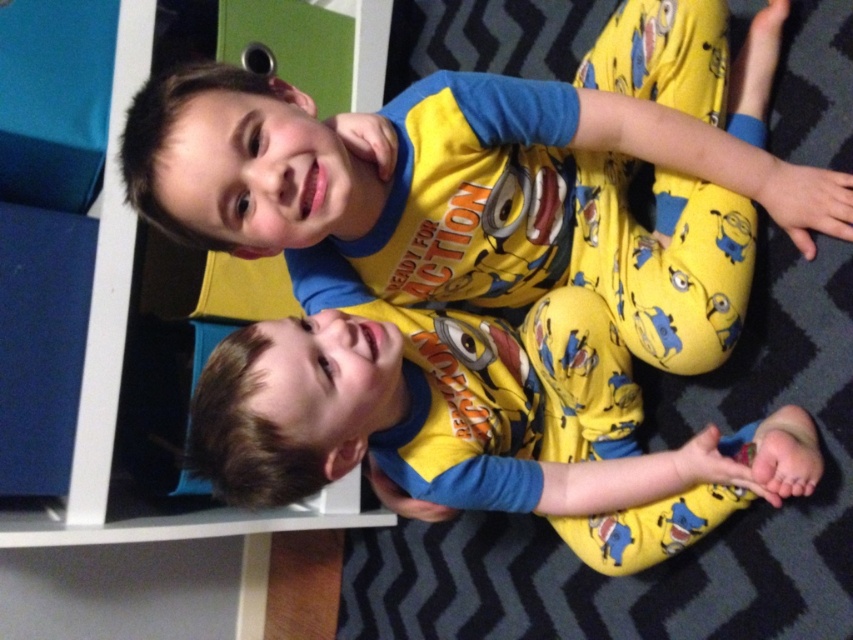
Is point (234, 520) less distant than point (624, 540)?

No, it is not.

Between matte plastic bookshelf at upper left and yellow cotton pajamas at lower center, which one appears on the left side from the viewer's perspective?

From the viewer's perspective, matte plastic bookshelf at upper left appears more on the left side.

Which is in front, point (107, 232) or point (740, 451)?

Point (740, 451)

The width and height of the screenshot is (853, 640). Find the location of `matte plastic bookshelf at upper left`. matte plastic bookshelf at upper left is located at coordinates (113, 417).